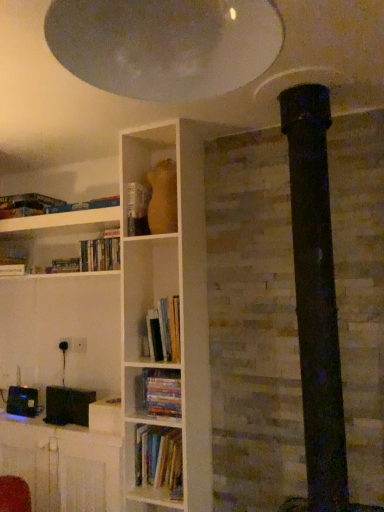
Question: Which direction should I rotate to look at hardcover books at center, arranged as the first book when ordered from the bottom?

Choices:
 (A) left
 (B) right

Answer: (A)

Question: Considering the relative sizes of hardcover books at center, the 2th book from the top, and white glossy exhaust hood at upper center in the image provided, is hardcover books at center, the 2th book from the top, shorter than white glossy exhaust hood at upper center?

Choices:
 (A) no
 (B) yes

Answer: (A)

Question: Considering the relative positions of hardcover books at center, positioned as the 2th book in bottom-to-top order, and white glossy exhaust hood at upper center in the image provided, is hardcover books at center, positioned as the 2th book in bottom-to-top order, to the left of white glossy exhaust hood at upper center from the viewer's perspective?

Choices:
 (A) no
 (B) yes

Answer: (B)

Question: Considering the relative sizes of hardcover books at center, positioned as the 2th book in bottom-to-top order, and white glossy exhaust hood at upper center in the image provided, is hardcover books at center, positioned as the 2th book in bottom-to-top order, bigger than white glossy exhaust hood at upper center?

Choices:
 (A) yes
 (B) no

Answer: (B)

Question: Is hardcover books at center, the 2th book from the top, completely or partially outside of white glossy exhaust hood at upper center?

Choices:
 (A) no
 (B) yes

Answer: (B)

Question: Could you tell me if hardcover books at center, the 2th book from the top, is turned towards white glossy exhaust hood at upper center?

Choices:
 (A) no
 (B) yes

Answer: (A)

Question: Is hardcover books at center, the 2th book from the top, taller than white glossy exhaust hood at upper center?

Choices:
 (A) no
 (B) yes

Answer: (B)

Question: Is the depth of black plastic table at lower left less than that of hardcover book at center?

Choices:
 (A) no
 (B) yes

Answer: (B)

Question: Considering the relative positions of black plastic table at lower left and hardcover book at center in the image provided, is black plastic table at lower left to the left of hardcover book at center from the viewer's perspective?

Choices:
 (A) yes
 (B) no

Answer: (A)

Question: From a real-world perspective, is black plastic table at lower left on top of hardcover book at center?

Choices:
 (A) yes
 (B) no

Answer: (B)

Question: Can you confirm if black plastic table at lower left is positioned to the right of hardcover book at center?

Choices:
 (A) yes
 (B) no

Answer: (B)

Question: Does black plastic table at lower left have a lesser width compared to hardcover book at center?

Choices:
 (A) no
 (B) yes

Answer: (A)

Question: From a real-world perspective, does black plastic table at lower left sit lower than hardcover book at center?

Choices:
 (A) no
 (B) yes

Answer: (B)

Question: Is black plastic table at lower left at the back of hardcover books at center, the 2th book from the top?

Choices:
 (A) yes
 (B) no

Answer: (B)